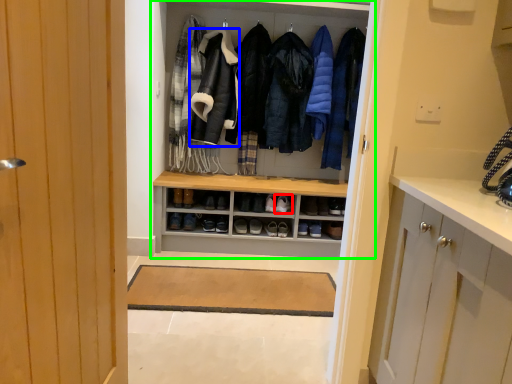
Question: Estimate the real-world distances between objects in this image. Which object is farther from footwear (highlighted by a red box), garment (highlighted by a blue box) or shelf (highlighted by a green box)?

Choices:
 (A) garment
 (B) shelf

Answer: (B)